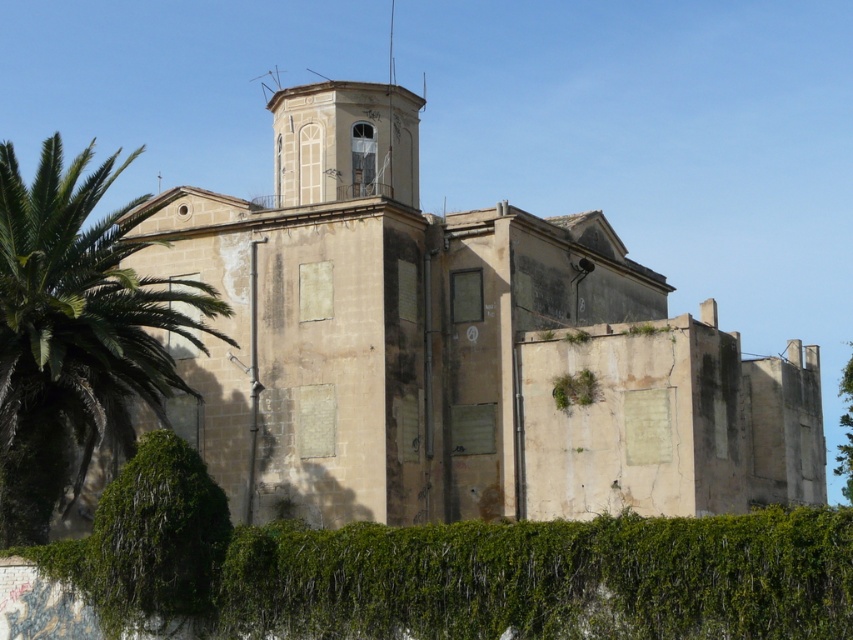
Question: Which object is positioned closest to the green leafy palm tree at left?

Choices:
 (A) green mossy hedge at lower left
 (B) green leafy hedge at lower center
 (C) beige stone church at center
 (D) green leafy tree at upper right

Answer: (C)

Question: Does green leafy hedge at lower center appear over white painted stone bell tower at upper center?

Choices:
 (A) yes
 (B) no

Answer: (B)

Question: Which point appears farthest from the camera in this image?

Choices:
 (A) (567, 538)
 (B) (285, 113)
 (C) (844, 476)
 (D) (175, 467)

Answer: (C)

Question: Can you confirm if green mossy hedge at lower left is positioned below white painted stone bell tower at upper center?

Choices:
 (A) yes
 (B) no

Answer: (A)

Question: Is green leafy palm tree at left to the right of green leafy tree at upper right from the viewer's perspective?

Choices:
 (A) no
 (B) yes

Answer: (A)

Question: Among these objects, which one is farthest from the camera?

Choices:
 (A) green leafy palm tree at left
 (B) white painted stone bell tower at upper center
 (C) green mossy hedge at lower left
 (D) green leafy hedge at lower center

Answer: (B)